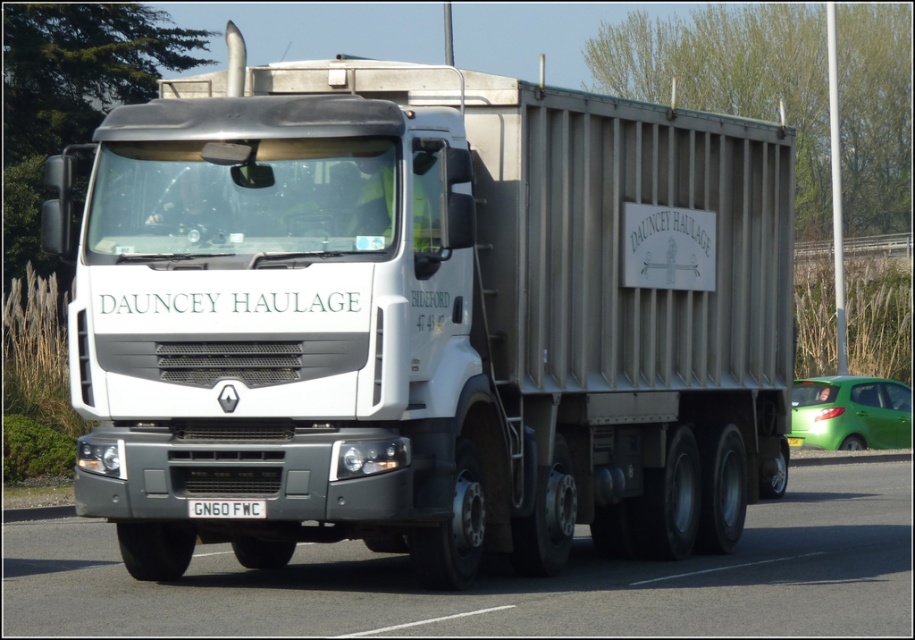
You are a photographer trying to capture both the white matte truck at center and the green matte hatchback at right in a single frame. Given their widths, which vehicle should you position closer to the camera to ensure both fit horizontally in the photo?

Since the white matte truck at center is thinner than the green matte hatchback at right, you should position the white matte truck at center closer to the camera. This way, its apparent width in the frame will be larger, balancing the sizes of both vehicles in the photo.

You are a pedestrian standing on the sidewalk. You see the white matte truck at center and the gray asphalt highway at center. Which object is closer to your left side?

The white matte truck at center is closer to your left side since it is positioned to the left of the gray asphalt highway at center.

You are a pedestrian standing on the sidewalk. You see the gray asphalt highway at center and the green matte hatchback at right. Which one is lower from the ground?

The gray asphalt highway at center is below the green matte hatchback at right, so the gray asphalt highway at center is lower from the ground.